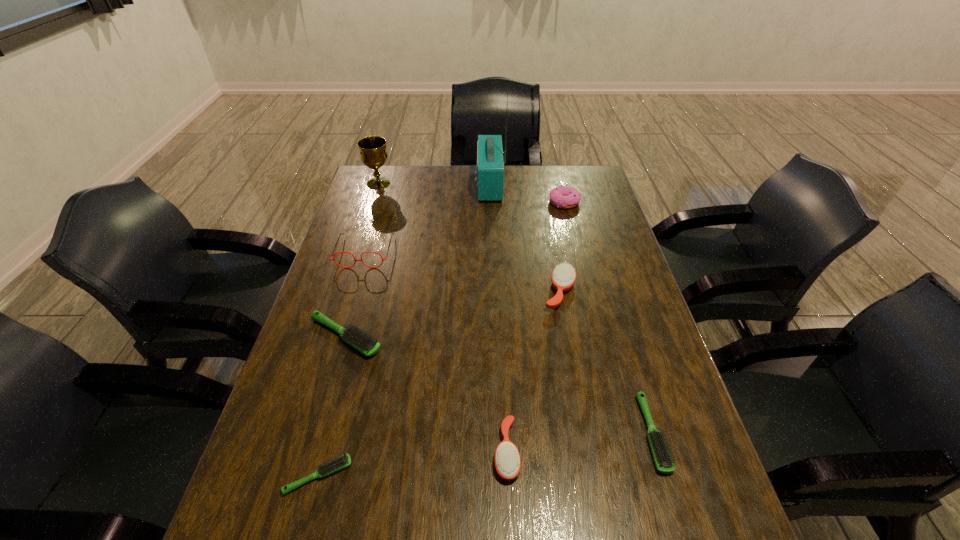
Identify the location of doughnut that is at the far edge. Image resolution: width=960 pixels, height=540 pixels. (565, 197).

The height and width of the screenshot is (540, 960). Identify the location of chalice positioned at the left edge. (373, 154).

Where is `spectacles present at the left edge`? Image resolution: width=960 pixels, height=540 pixels. spectacles present at the left edge is located at coordinates (333, 259).

Identify the location of doughnut situated at the right edge. [x=565, y=197].

What are the coordinates of `hairbrush at the right edge` in the screenshot? It's located at (662, 457).

Locate an element on the screen. This screenshot has height=540, width=960. object positioned at the far left corner is located at coordinates (373, 154).

Find the location of a particular element. The height and width of the screenshot is (540, 960). object situated at the far right corner is located at coordinates (565, 197).

Where is `vacant space at the far edge`? vacant space at the far edge is located at coordinates (461, 184).

Identify the location of free region at the left edge. The width and height of the screenshot is (960, 540). (357, 222).

In the image, there is a desktop. Where is `vacant space at the right edge`? The height and width of the screenshot is (540, 960). vacant space at the right edge is located at coordinates (615, 238).